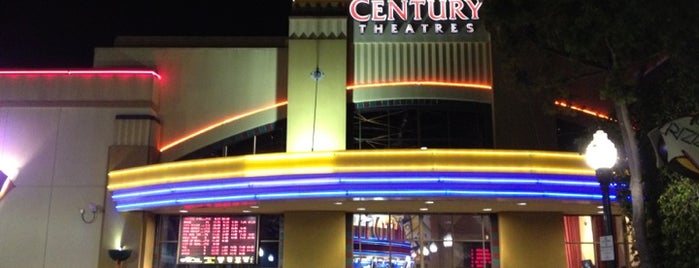
Image resolution: width=699 pixels, height=268 pixels. What are the coordinates of `light` in the screenshot? It's located at (314, 77).